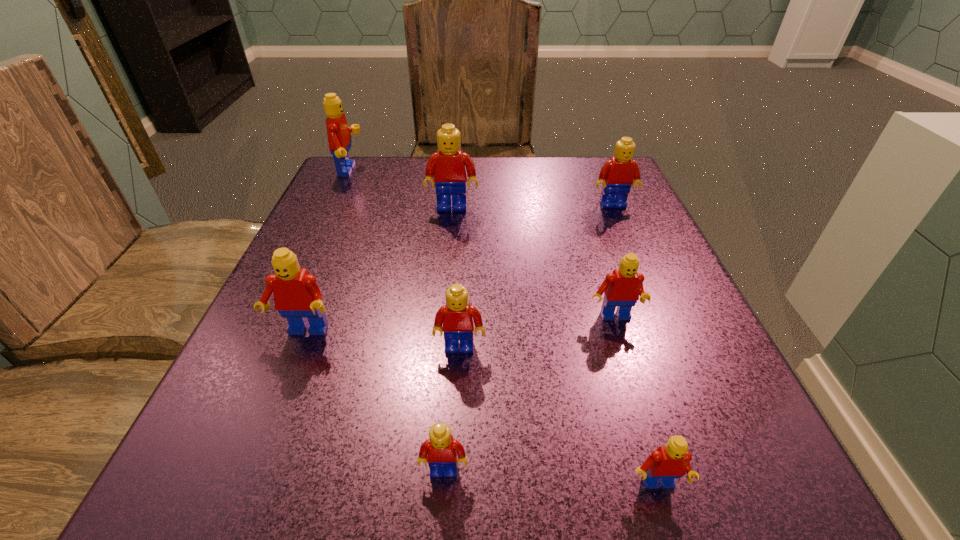
Where is `vacant space that's between the second nearest yellow Lego and the third smallest yellow Lego`? vacant space that's between the second nearest yellow Lego and the third smallest yellow Lego is located at coordinates (537, 276).

You are a GUI agent. You are given a task and a screenshot of the screen. Output one action in this format:
    pyautogui.click(x=<x>, y=<y>)
    Task: Click on the free space between the third smallest yellow Lego and the second smallest yellow Lego
    Image resolution: width=960 pixels, height=540 pixels.
    Given the screenshot: What is the action you would take?
    pyautogui.click(x=537, y=276)

Identify the location of free space between the biggest red Lego and the smallest red Lego. The height and width of the screenshot is (540, 960). (503, 329).

This screenshot has width=960, height=540. What are the coordinates of `free space between the third smallest red Lego and the biggest yellow Lego` in the screenshot? It's located at (377, 270).

Select which object is the third closest to the biggest yellow Lego. Please provide its 2D coordinates. Your answer should be formatted as a tuple, i.e. [(x, y)], where the tuple contains the x and y coordinates of a point satisfying the conditions above.

[(297, 296)]

Locate an element on the screen. The image size is (960, 540). object that can be found as the sixth closest to the second smallest red Lego is located at coordinates (297, 296).

Locate an element on the screen. This screenshot has width=960, height=540. Lego that is the fifth nearest to the third biggest red Lego is located at coordinates (450, 166).

Identify which Lego is the sixth nearest to the rightmost yellow Lego. Please provide its 2D coordinates. Your answer should be formatted as a tuple, i.e. [(x, y)], where the tuple contains the x and y coordinates of a point satisfying the conditions above.

[(672, 461)]

The width and height of the screenshot is (960, 540). Find the location of `the closest red Lego to the farthest Lego`. the closest red Lego to the farthest Lego is located at coordinates (297, 296).

The image size is (960, 540). What are the coordinates of `red Lego that stands as the third closest to the second smallest red Lego` in the screenshot? It's located at (339, 138).